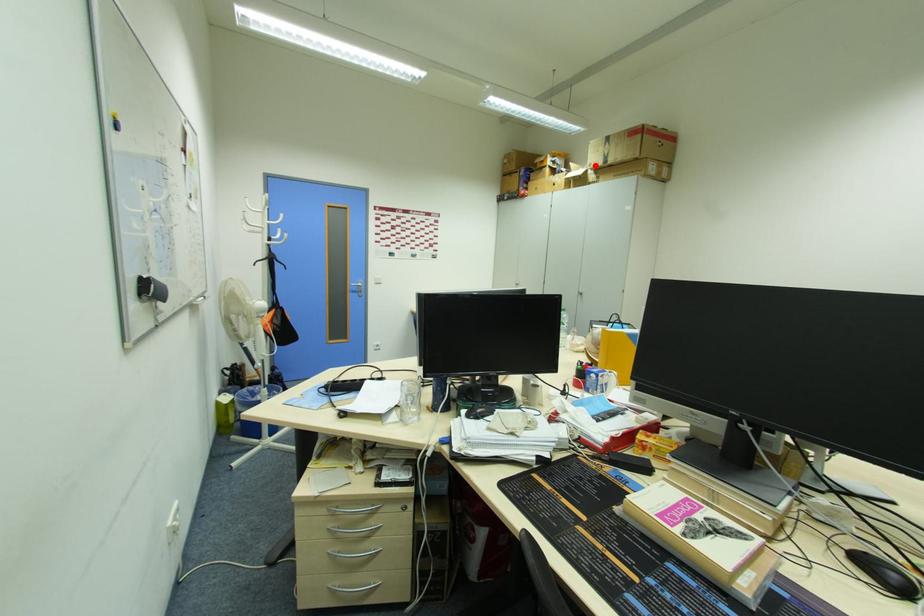
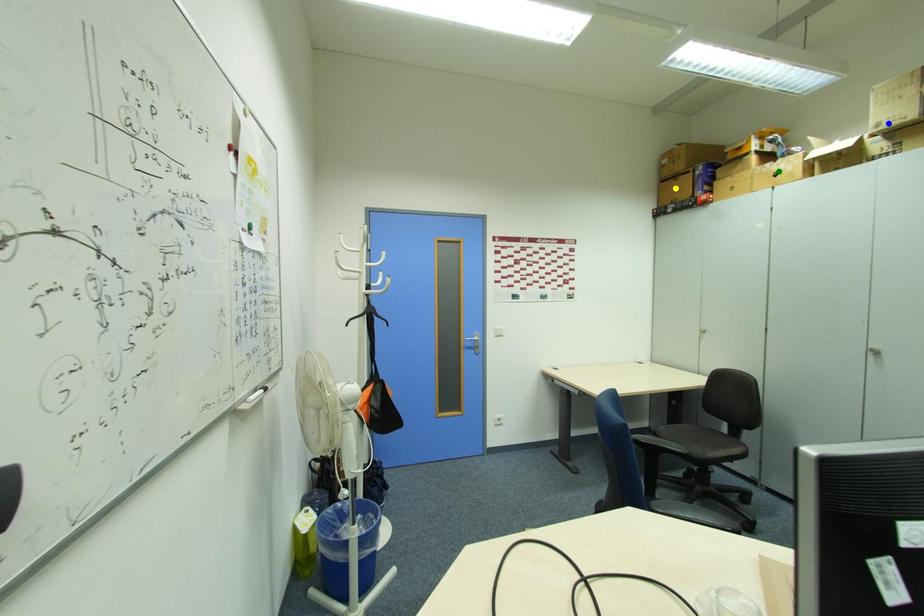
Question: I am providing you with two images of the same scene from different viewpoints. A red point is marked on the first image. You are given multiple points on the second image. Which point in image 2 represents the same 3d spot as the red point in image 1?

Choices:
 (A) yellow point
 (B) blue point
 (C) green point

Answer: (B)